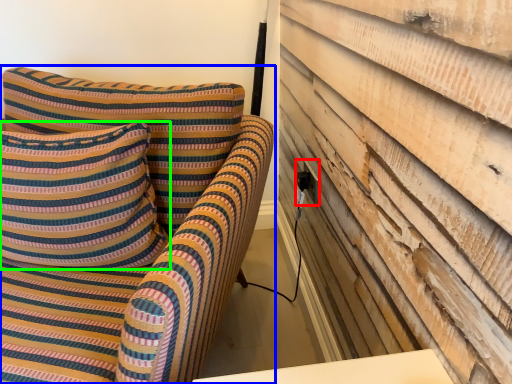
Question: Based on their relative distances, which object is nearer to electric outlet (highlighted by a red box)? Choose from furniture (highlighted by a blue box) and pillow (highlighted by a green box).

Choices:
 (A) furniture
 (B) pillow

Answer: (A)